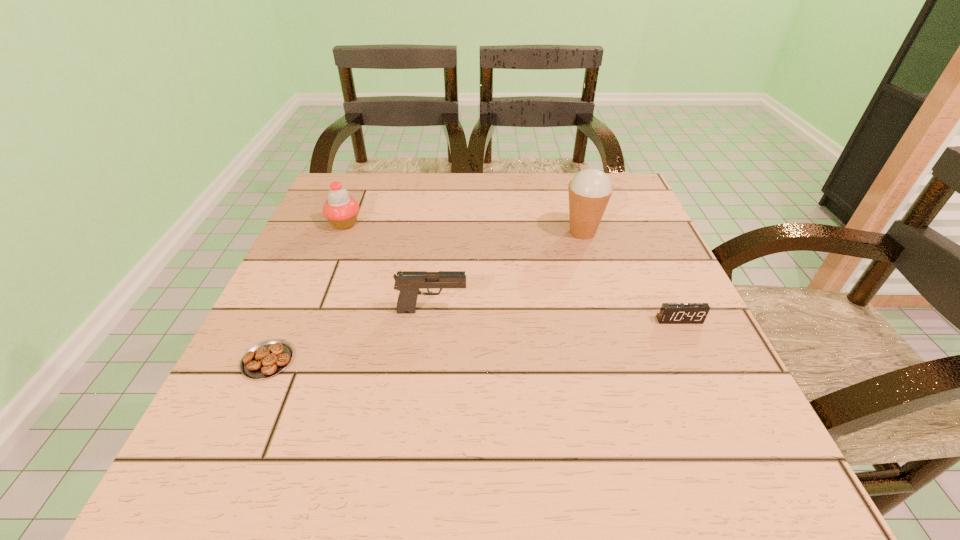
Identify the location of object present at the far left corner. (341, 210).

Locate an element on the screen. Image resolution: width=960 pixels, height=540 pixels. object located at the far right corner is located at coordinates (590, 189).

Image resolution: width=960 pixels, height=540 pixels. In the image, there is a desktop. Find the location of `vacant space at the far edge`. vacant space at the far edge is located at coordinates (467, 192).

Where is `free space at the left edge of the desktop`? This screenshot has width=960, height=540. free space at the left edge of the desktop is located at coordinates (298, 375).

Locate an element on the screen. vacant space at the right edge of the desktop is located at coordinates pyautogui.click(x=687, y=371).

You are a GUI agent. You are given a task and a screenshot of the screen. Output one action in this format:
    pyautogui.click(x=<x>, y=<y>)
    Task: Click on the blank space at the far left corner of the desktop
    The image size is (960, 540).
    Given the screenshot: What is the action you would take?
    pyautogui.click(x=360, y=194)

Image resolution: width=960 pixels, height=540 pixels. Find the location of `free location at the far right corner`. free location at the far right corner is located at coordinates (604, 211).

Find the location of a particular element. vacant point located between the tallest object and the cupcake is located at coordinates (464, 228).

Locate an element on the screen. The height and width of the screenshot is (540, 960). vacant space that's between the pistol and the nearest object is located at coordinates (350, 335).

The image size is (960, 540). I want to click on unoccupied area between the pastry and the cupcake, so click(306, 292).